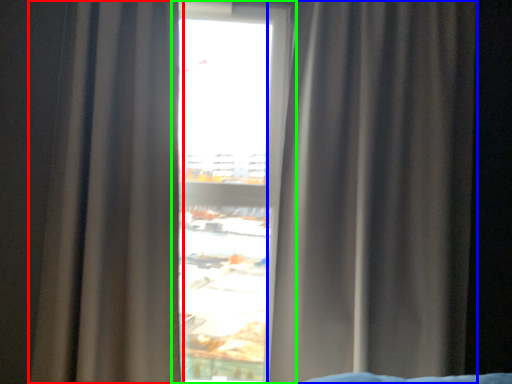
Question: Which object is the closest to the curtain (highlighted by a red box)? Choose among these: curtain (highlighted by a blue box) or window (highlighted by a green box).

Choices:
 (A) curtain
 (B) window

Answer: (B)